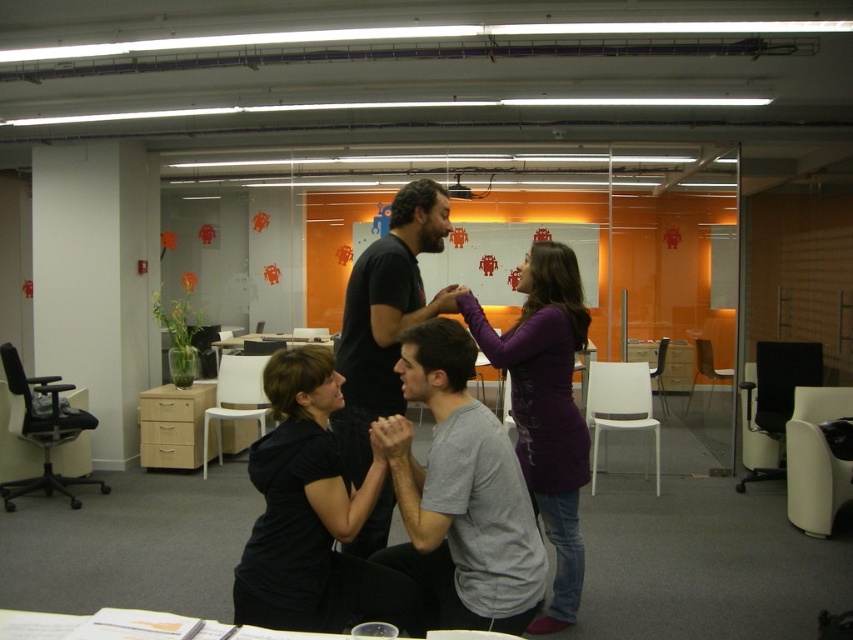
Question: Considering the relative positions of purple matte shirt at upper center and dark gray t-shirt at center in the image provided, where is purple matte shirt at upper center located with respect to dark gray t-shirt at center?

Choices:
 (A) below
 (B) above

Answer: (A)

Question: Which is farther from the dark gray t-shirt at center?

Choices:
 (A) gray cotton shirt at center
 (B) black matte shirt at center

Answer: (A)

Question: Which is farther from the purple matte shirt at upper center?

Choices:
 (A) dark gray t-shirt at center
 (B) black matte shirt at center

Answer: (B)

Question: Among these objects, which one is nearest to the camera?

Choices:
 (A) gray cotton shirt at center
 (B) black matte shirt at center

Answer: (A)

Question: Does gray cotton shirt at center appear on the right side of black matte shirt at center?

Choices:
 (A) yes
 (B) no

Answer: (A)

Question: Does gray cotton shirt at center have a larger size compared to dark gray t-shirt at center?

Choices:
 (A) no
 (B) yes

Answer: (A)